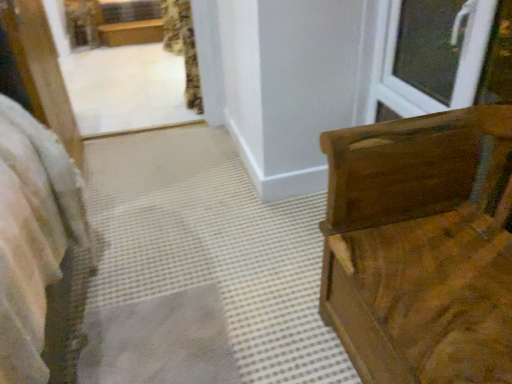
This screenshot has height=384, width=512. What do you see at coordinates (183, 47) in the screenshot?
I see `floral fabric curtain at upper center` at bounding box center [183, 47].

The image size is (512, 384). Find the location of `wooden chest at right`. wooden chest at right is located at coordinates (422, 247).

In order to face white plastic window at upper right, should I rotate leftwards or rightwards?

You should look right and rotate roughly 20.459 degrees.

Find the location of a particular element. Image resolution: width=512 pixels, height=384 pixels. white plastic window at upper right is located at coordinates (440, 56).

Where is `floral fabric curtain at upper center`? This screenshot has width=512, height=384. floral fabric curtain at upper center is located at coordinates (183, 47).

From a real-world perspective, between white plastic window at upper right and floral fabric curtain at upper center, who is vertically lower?

In real-world perspective, floral fabric curtain at upper center is lower.

Measure the distance from white plastic window at upper right to floral fabric curtain at upper center.

The distance of white plastic window at upper right from floral fabric curtain at upper center is 8.68 feet.

Which object is closer to the camera taking this photo, white plastic window at upper right or floral fabric curtain at upper center?

white plastic window at upper right.

Is white plastic window at upper right aimed at floral fabric curtain at upper center?

No, white plastic window at upper right is not turned towards floral fabric curtain at upper center.

From a real-world perspective, is white plastic window at upper right under wooden chest at right?

Incorrect, from a real-world perspective, white plastic window at upper right is higher than wooden chest at right.

Based on the photo, from the image's perspective, which is above, white plastic window at upper right or wooden chest at right?

From the image's view, white plastic window at upper right is above.

Which object is thinner, white plastic window at upper right or wooden chest at right?

white plastic window at upper right is thinner.

The height and width of the screenshot is (384, 512). Identify the location of window that appears behind the wooden chest at right. (440, 56).

Is floral fabric curtain at upper center thinner than wooden chest at right?

Indeed, floral fabric curtain at upper center has a lesser width compared to wooden chest at right.

Based on the photo, is floral fabric curtain at upper center facing towards wooden chest at right?

No, floral fabric curtain at upper center is not aimed at wooden chest at right.

This screenshot has height=384, width=512. I want to click on curtain on the left of the wooden chest at right, so click(x=183, y=47).

How many degrees apart are the facing directions of floral fabric curtain at upper center and wooden chest at right?

4.42 degrees separate the facing orientations of floral fabric curtain at upper center and wooden chest at right.

Measure the distance between wooden chest at right and floral fabric curtain at upper center.

wooden chest at right is 3.21 meters from floral fabric curtain at upper center.

Would you say floral fabric curtain at upper center is part of wooden chest at right's contents?

Actually, floral fabric curtain at upper center is outside wooden chest at right.

Does point (486, 142) come in front of point (190, 74)?

Yes, point (486, 142) is closer to viewer.

Considering the relative sizes of wooden chest at right and floral fabric curtain at upper center in the image provided, is wooden chest at right thinner than floral fabric curtain at upper center?

No, wooden chest at right is not thinner than floral fabric curtain at upper center.

Is floral fabric curtain at upper center turned away from white plastic window at upper right?

floral fabric curtain at upper center does not have its back to white plastic window at upper right.

Is floral fabric curtain at upper center taller or shorter than white plastic window at upper right?

In the image, floral fabric curtain at upper center appears to be taller than white plastic window at upper right.

Considering the sizes of floral fabric curtain at upper center and white plastic window at upper right in the image, is floral fabric curtain at upper center wider or thinner than white plastic window at upper right?

In the image, floral fabric curtain at upper center appears to be wider than white plastic window at upper right.

Can you tell me how much floral fabric curtain at upper center and white plastic window at upper right differ in facing direction?

They differ by 2.85 degrees in their facing directions.

Is wooden chest at right far from white plastic window at upper right?

That's not correct — wooden chest at right is a little close to white plastic window at upper right.

How many degrees apart are the facing directions of wooden chest at right and white plastic window at upper right?

wooden chest at right and white plastic window at upper right are facing 1.57 degrees away from each other.

Considering the positions of objects wooden chest at right and white plastic window at upper right in the image provided, who is behind, wooden chest at right or white plastic window at upper right?

white plastic window at upper right is behind.

Considering the relative sizes of wooden chest at right and white plastic window at upper right in the image provided, is wooden chest at right thinner than white plastic window at upper right?

In fact, wooden chest at right might be wider than white plastic window at upper right.

Locate an element on the screen. Image resolution: width=512 pixels, height=384 pixels. curtain below the white plastic window at upper right (from a real-world perspective) is located at coordinates (183, 47).

I want to click on window to the right of wooden chest at right, so click(x=440, y=56).

Based on their spatial positions, is white plastic window at upper right or floral fabric curtain at upper center further from wooden chest at right?

Based on the image, floral fabric curtain at upper center appears to be further to wooden chest at right.

Estimate the real-world distances between objects in this image. Which object is further from white plastic window at upper right, wooden chest at right or floral fabric curtain at upper center?

floral fabric curtain at upper center.

When comparing their distances from floral fabric curtain at upper center, does wooden chest at right or white plastic window at upper right seem further?

wooden chest at right is further to floral fabric curtain at upper center.

When comparing their distances from white plastic window at upper right, does floral fabric curtain at upper center or wooden chest at right seem further?

Among the two, floral fabric curtain at upper center is located further to white plastic window at upper right.

Estimate the real-world distances between objects in this image. Which object is closer to wooden chest at right, floral fabric curtain at upper center or white plastic window at upper right?

white plastic window at upper right lies closer to wooden chest at right than the other object.

Based on their spatial positions, is white plastic window at upper right or wooden chest at right further from floral fabric curtain at upper center?

wooden chest at right.

I want to click on window located between wooden chest at right and floral fabric curtain at upper center in the depth direction, so click(440, 56).